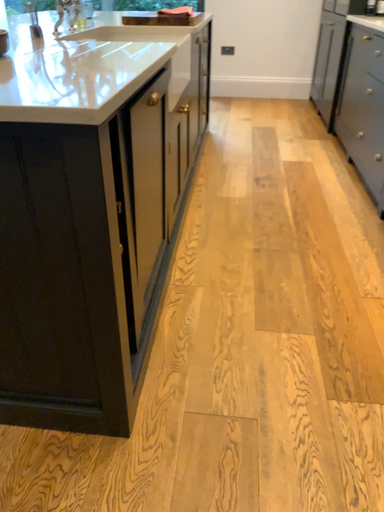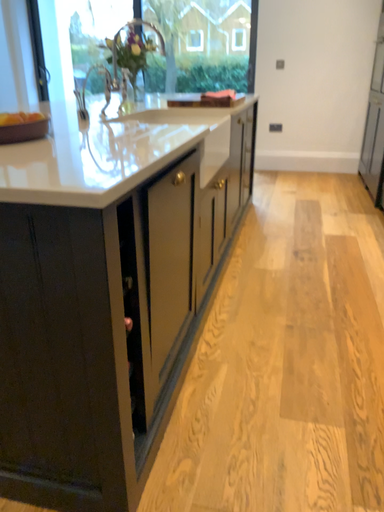
Question: Which way did the camera rotate in the video?

Choices:
 (A) rotated downward
 (B) rotated upward

Answer: (B)